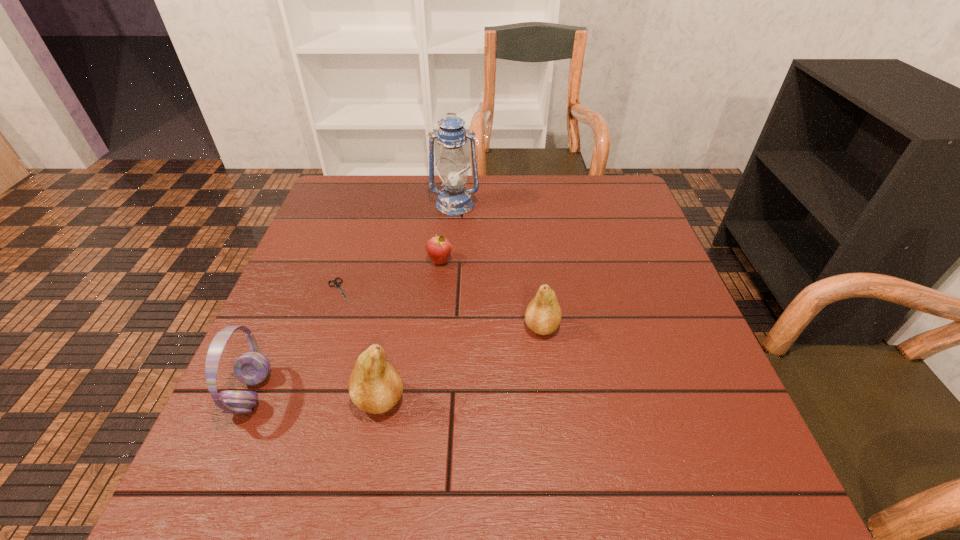
The width and height of the screenshot is (960, 540). Find the location of `the nearer pear`. the nearer pear is located at coordinates (375, 386).

Find the location of `the taller pear`. the taller pear is located at coordinates coord(375,386).

Identify the location of the rightmost object. The image size is (960, 540). (543, 314).

This screenshot has width=960, height=540. What are the coordinates of `the right pear` in the screenshot? It's located at (543, 314).

Where is `the farthest object`? The width and height of the screenshot is (960, 540). the farthest object is located at coordinates (454, 200).

This screenshot has height=540, width=960. Find the location of `the tallest object`. the tallest object is located at coordinates (454, 200).

Locate an element on the screen. This screenshot has width=960, height=540. the second shortest object is located at coordinates (438, 248).

At what (x,y) coordinates should I click in order to perform the action: click on the second farthest object. Please return your answer as a coordinate pair (x, y). The height and width of the screenshot is (540, 960). Looking at the image, I should click on (438, 248).

In order to click on shears in this screenshot , I will do `click(336, 284)`.

Where is `the shortest object`? The height and width of the screenshot is (540, 960). the shortest object is located at coordinates (336, 284).